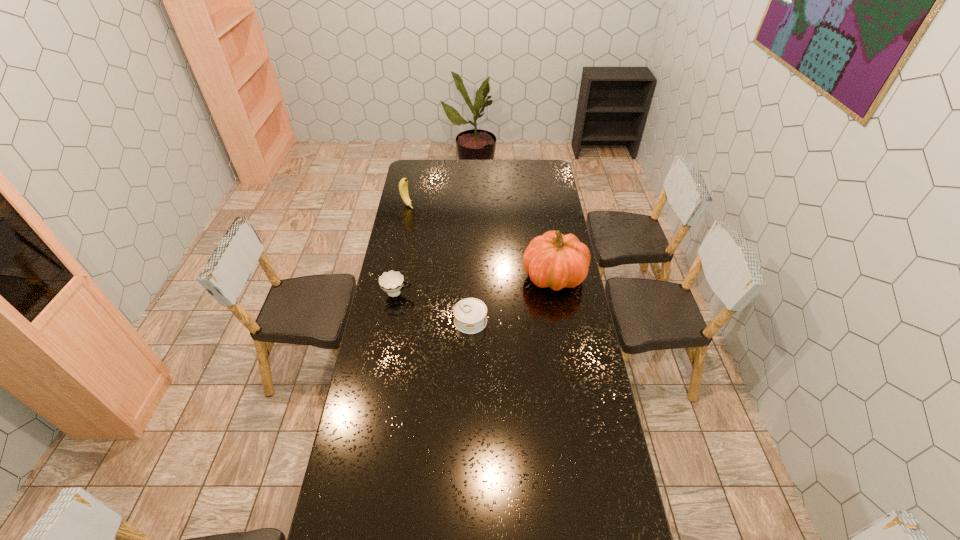
Locate an element on the screen. free space on the desktop that is between the nearest object and the rightmost object and is positioned from the stem of the farthest object is located at coordinates (519, 295).

What are the coordinates of `vacant space on the desktop that is between the nearest object and the tallest object and is positioned on the side of the third tallest object with the handle` in the screenshot? It's located at (512, 300).